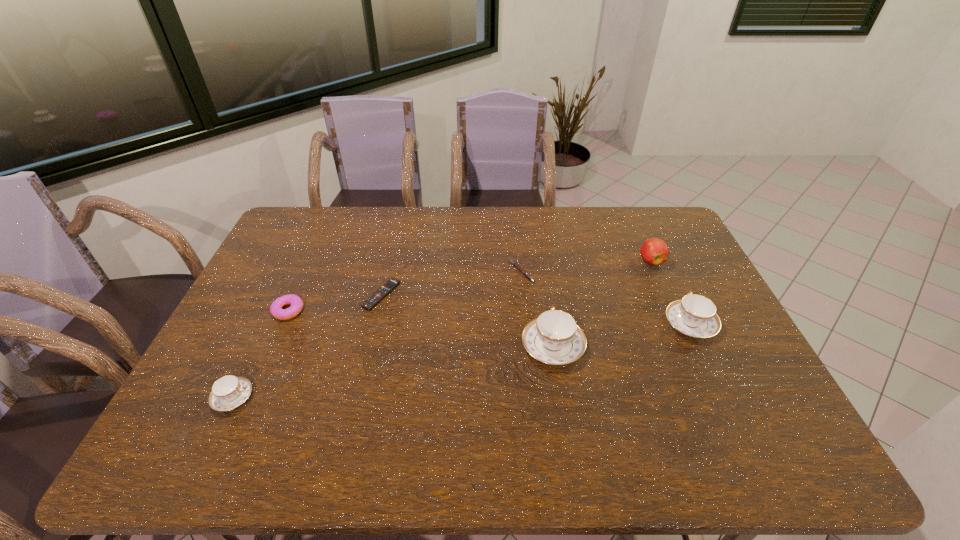
At what (x,y) coordinates should I click in order to perform the action: click on vacant space located on the front of the apple. Please return your answer as a coordinate pair (x, y). Looking at the image, I should click on (700, 370).

The width and height of the screenshot is (960, 540). I want to click on free space located on the back of the third shortest object, so click(306, 272).

Locate an element on the screen. object present at the near edge is located at coordinates (228, 392).

At what (x,y) coordinates should I click in order to perform the action: click on teacup at the left edge. Please return your answer as a coordinate pair (x, y). Looking at the image, I should click on (228, 392).

Locate an element on the screen. doughnut situated at the left edge is located at coordinates (276, 310).

Image resolution: width=960 pixels, height=540 pixels. Find the location of `teacup present at the right edge`. teacup present at the right edge is located at coordinates (695, 315).

Where is `apple at the right edge`? Image resolution: width=960 pixels, height=540 pixels. apple at the right edge is located at coordinates (654, 251).

Where is `object situated at the near left corner`? object situated at the near left corner is located at coordinates (228, 392).

In the image, there is a desktop. What are the coordinates of `free region at the far edge` in the screenshot? It's located at (496, 235).

Where is `blank area at the near edge`? This screenshot has width=960, height=540. blank area at the near edge is located at coordinates (540, 413).